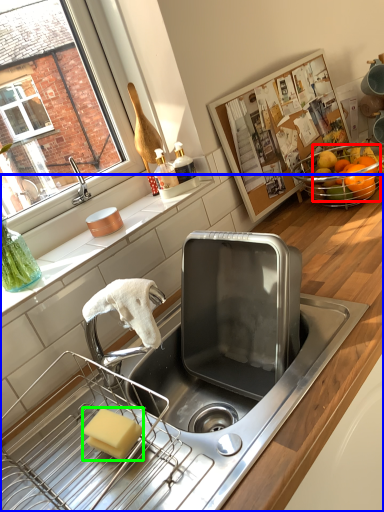
Question: Which object is positioned closest to fruit (highlighted by a red box)? Select from countertop (highlighted by a blue box) and soap (highlighted by a green box).

Choices:
 (A) countertop
 (B) soap

Answer: (A)